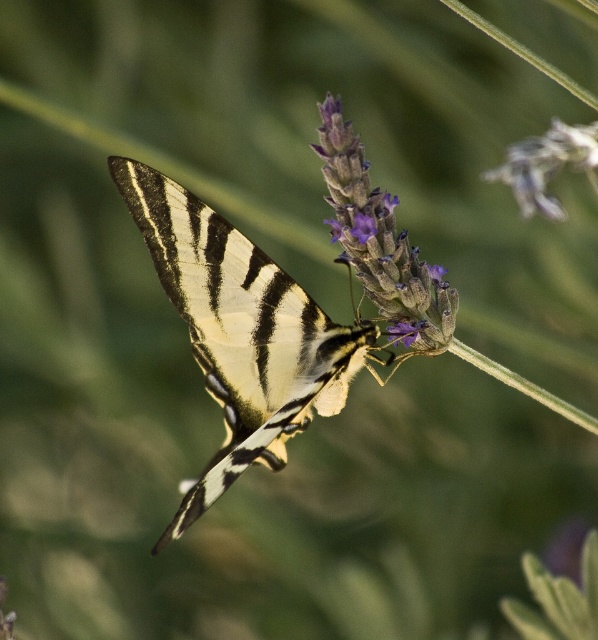
Does shiny gold butterfly at center have a smaller size compared to purple fuzzy lavender at center?

Incorrect, shiny gold butterfly at center is not smaller in size than purple fuzzy lavender at center.

What do you see at coordinates (240, 332) in the screenshot?
I see `shiny gold butterfly at center` at bounding box center [240, 332].

Where is `shiny gold butterfly at center`? shiny gold butterfly at center is located at coordinates (240, 332).

Does shiny gold butterfly at center come behind purple matte flower at upper center?

Yes, shiny gold butterfly at center is behind purple matte flower at upper center.

Can you confirm if shiny gold butterfly at center is positioned below purple matte flower at upper center?

Indeed, shiny gold butterfly at center is positioned under purple matte flower at upper center.

Between point (224, 481) and point (523, 156), which one is positioned behind?

The point (224, 481) is more distant.

Locate an element on the screen. shiny gold butterfly at center is located at coordinates (240, 332).

Who is positioned more to the left, purple fuzzy lavender at center or purple matte flower at upper center?

purple fuzzy lavender at center

Is purple fuzzy lavender at center to the right of purple matte flower at upper center from the viewer's perspective?

In fact, purple fuzzy lavender at center is to the left of purple matte flower at upper center.

Is point (419, 292) farther from viewer compared to point (565, 161)?

That is True.

The height and width of the screenshot is (640, 598). Find the location of `purple fuzzy lavender at center`. purple fuzzy lavender at center is located at coordinates (380, 243).